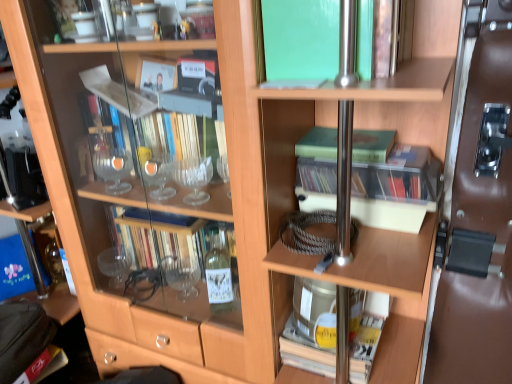
At what (x,y) coordinates should I click in order to perform the action: click on green matte book at upper center, the 1th book from the top. Please return your answer as a coordinate pair (x, y). Looking at the image, I should click on (301, 38).

What is the approximate height of brown leather door at right?

1.14 meters.

Measure the distance between point (4, 342) and camera.

They are 1.12 meters apart.

The width and height of the screenshot is (512, 384). Describe the element at coordinates (311, 328) in the screenshot. I see `metallic silver book at center, which appears as the fifth book when viewed from the top` at that location.

At what (x,y) coordinates should I click in order to perform the action: click on clear plastic case at center, the fourth book in the top-to-bottom sequence. Please return your answer as a coordinate pair (x, y). Looking at the image, I should click on (392, 182).

This screenshot has width=512, height=384. Identify the location of green matte book at upper center, the 1th book from the top. (301, 38).

Considering the relative positions of brown leather door at right and translucent plastic case at center, which ranks as the 3th book in bottom-to-top order, in the image provided, is brown leather door at right to the left of translucent plastic case at center, which ranks as the 3th book in bottom-to-top order, from the viewer's perspective?

No.

From the image's perspective, which is below, brown leather door at right or translucent plastic case at center, which appears as the 3th book when viewed from the top?

brown leather door at right is shown below in the image.

Which of these two, brown leather door at right or translucent plastic case at center, which appears as the 3th book when viewed from the top, is wider?

Wider between the two is translucent plastic case at center, which appears as the 3th book when viewed from the top.

In the scene shown: From their relative heights in the image, would you say brown leather door at right is taller or shorter than translucent plastic case at center, which ranks as the 3th book in bottom-to-top order?

In the image, brown leather door at right appears to be taller than translucent plastic case at center, which ranks as the 3th book in bottom-to-top order.

Which object is positioned more to the right, brown leather door at right or leather handbag at lower left?

From the viewer's perspective, brown leather door at right appears more on the right side.

From a real-world perspective, who is located lower, brown leather door at right or leather handbag at lower left?

In real-world perspective, leather handbag at lower left is lower.

Considering the relative sizes of brown leather door at right and leather handbag at lower left in the image provided, is brown leather door at right smaller than leather handbag at lower left?

Actually, brown leather door at right might be larger than leather handbag at lower left.

From the image's perspective, is green matte book at center, which ranks as the 4th book in bottom-to-top order, located above or below translucent plastic case at center, which ranks as the 3th book in bottom-to-top order?

Based on their image positions, green matte book at center, which ranks as the 4th book in bottom-to-top order, is located above translucent plastic case at center, which ranks as the 3th book in bottom-to-top order.

From a real-world perspective, is green matte book at center, which ranks as the 4th book in bottom-to-top order, above or below translucent plastic case at center, which ranks as the 3th book in bottom-to-top order?

In terms of real-world spatial position, green matte book at center, which ranks as the 4th book in bottom-to-top order, is above translucent plastic case at center, which ranks as the 3th book in bottom-to-top order.

Does green matte book at center, which ranks as the 4th book in bottom-to-top order, have a lesser height compared to translucent plastic case at center, which appears as the 3th book when viewed from the top?

Correct, green matte book at center, which ranks as the 4th book in bottom-to-top order, is not as tall as translucent plastic case at center, which appears as the 3th book when viewed from the top.

Is green matte book at center, acting as the 2th book starting from the top, inside the boundaries of translucent plastic case at center, which ranks as the 3th book in bottom-to-top order, or outside?

The correct answer is: outside.

Are green matte book at upper center, the 1th book from the top, and clear plastic case at center, the fourth book in the top-to-bottom sequence, located far from each other?

They are positioned close to each other.

From the image's perspective, between green matte book at upper center, the 1th book from the top, and clear plastic case at center, the fourth book in the top-to-bottom sequence, which one is located above?

green matte book at upper center, the 1th book from the top.

Is green matte book at upper center, the 1th book from the top, turned away from clear plastic case at center, the fourth book in the top-to-bottom sequence?

That's not correct — green matte book at upper center, the 1th book from the top, is not looking away from clear plastic case at center, the fourth book in the top-to-bottom sequence.

Which object is wider, translucent plastic case at center, which appears as the 3th book when viewed from the top, or clear plastic case at center, which appears as the second book when ordered from the bottom?

With larger width is clear plastic case at center, which appears as the second book when ordered from the bottom.

Based on the photo, from a real-world perspective, is translucent plastic case at center, which ranks as the 3th book in bottom-to-top order, physically located above or below clear plastic case at center, the fourth book in the top-to-bottom sequence?

translucent plastic case at center, which ranks as the 3th book in bottom-to-top order, is situated higher than clear plastic case at center, the fourth book in the top-to-bottom sequence, in the real world.

From the image's perspective, which book is the 1st one below the translucent plastic case at center, which appears as the 3th book when viewed from the top? Please provide its 2D coordinates.

[(392, 182)]

From the picture: Is translucent plastic case at center, which appears as the 3th book when viewed from the top, facing towards leather handbag at lower left?

No, translucent plastic case at center, which appears as the 3th book when viewed from the top, is not oriented towards leather handbag at lower left.

From a real-world perspective, which object rests below the other?

In real-world perspective, leather handbag at lower left is lower.

Is translucent plastic case at center, which appears as the 3th book when viewed from the top, to the left of leather handbag at lower left from the viewer's perspective?

Incorrect, translucent plastic case at center, which appears as the 3th book when viewed from the top, is not on the left side of leather handbag at lower left.

Locate an element on the screen. the 4th book in front of the leather handbag at lower left, starting your count from the anchor is located at coordinates (398, 183).

Is green matte book at upper center, acting as the 5th book starting from the bottom, at the back of clear plastic case at center, the fourth book in the top-to-bottom sequence?

No, clear plastic case at center, the fourth book in the top-to-bottom sequence,'s orientation is not away from green matte book at upper center, acting as the 5th book starting from the bottom.

Between point (334, 182) and point (309, 69), which one is positioned behind?

The point (334, 182) is farther.

Can you confirm if clear plastic case at center, which appears as the second book when ordered from the bottom, is smaller than green matte book at upper center, the 1th book from the top?

Yes, clear plastic case at center, which appears as the second book when ordered from the bottom, is smaller than green matte book at upper center, the 1th book from the top.

Which is more to the left, clear plastic case at center, the fourth book in the top-to-bottom sequence, or green matte book at upper center, the 1th book from the top?

green matte book at upper center, the 1th book from the top, is more to the left.

From the image's perspective, starting from the brown leather door at right, which book is the 2nd one above? Please provide its 2D coordinates.

[(398, 183)]

I want to click on handbag behind the brown leather door at right, so click(22, 337).

Which object lies nearer to the anchor point green matte book at upper center, acting as the 5th book starting from the bottom, metallic silver book at center, which is the 1th book in bottom-to-top order, or leather handbag at lower left?

metallic silver book at center, which is the 1th book in bottom-to-top order, is positioned closer to the anchor green matte book at upper center, acting as the 5th book starting from the bottom.

From the image, which object appears to be farther from green matte book at upper center, acting as the 5th book starting from the bottom, translucent plastic case at center, which ranks as the 3th book in bottom-to-top order, or brown leather door at right?

Among the two, brown leather door at right is located further to green matte book at upper center, acting as the 5th book starting from the bottom.

Which object lies nearer to the anchor point blue fabric box at lower left, metallic silver book at center, which is the 1th book in bottom-to-top order, or translucent plastic case at center, which ranks as the 3th book in bottom-to-top order?

metallic silver book at center, which is the 1th book in bottom-to-top order, is positioned closer to the anchor blue fabric box at lower left.

From the image, which object appears to be farther from clear plastic case at center, the fourth book in the top-to-bottom sequence, leather handbag at lower left or blue fabric box at lower left?

blue fabric box at lower left.

Based on their spatial positions, is leather handbag at lower left or green matte book at center, which ranks as the 4th book in bottom-to-top order, further from clear plastic case at center, which appears as the second book when ordered from the bottom?

Among the two, leather handbag at lower left is located further to clear plastic case at center, which appears as the second book when ordered from the bottom.

From the image, which object appears to be farther from translucent plastic case at center, which appears as the 3th book when viewed from the top, green matte book at center, acting as the 2th book starting from the top, or clear plastic case at center, which appears as the second book when ordered from the bottom?

green matte book at center, acting as the 2th book starting from the top, lies further to translucent plastic case at center, which appears as the 3th book when viewed from the top, than the other object.

Estimate the real-world distances between objects in this image. Which object is further from metallic silver book at center, which is the 1th book in bottom-to-top order, translucent plastic case at center, which appears as the 3th book when viewed from the top, or clear plastic case at center, the fourth book in the top-to-bottom sequence?

The object further to metallic silver book at center, which is the 1th book in bottom-to-top order, is translucent plastic case at center, which appears as the 3th book when viewed from the top.

Based on their spatial positions, is green matte book at upper center, acting as the 5th book starting from the bottom, or leather handbag at lower left further from clear plastic case at center, the fourth book in the top-to-bottom sequence?

Based on the image, leather handbag at lower left appears to be further to clear plastic case at center, the fourth book in the top-to-bottom sequence.

Where is `glass door that lies between green matte book at center, which ranks as the 4th book in bottom-to-top order, and metallic silver book at center, which is the 1th book in bottom-to-top order, from top to bottom`? This screenshot has height=384, width=512. glass door that lies between green matte book at center, which ranks as the 4th book in bottom-to-top order, and metallic silver book at center, which is the 1th book in bottom-to-top order, from top to bottom is located at coordinates (477, 226).

The width and height of the screenshot is (512, 384). In order to click on book positioned between green matte book at upper center, acting as the 5th book starting from the bottom, and green matte book at center, acting as the 2th book starting from the top, from near to far in this screenshot , I will do `click(398, 183)`.

Locate an element on the screen. The image size is (512, 384). book between blue fabric box at lower left and green matte book at center, which ranks as the 4th book in bottom-to-top order is located at coordinates (301, 38).

The height and width of the screenshot is (384, 512). Find the location of `book between translucent plastic case at center, which appears as the 3th book when viewed from the top, and metallic silver book at center, which is the 1th book in bottom-to-top order, from top to bottom`. book between translucent plastic case at center, which appears as the 3th book when viewed from the top, and metallic silver book at center, which is the 1th book in bottom-to-top order, from top to bottom is located at coordinates (392, 182).